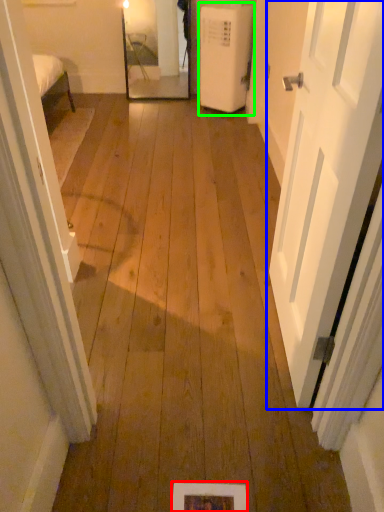
Question: Which object is positioned closest to picture frame (highlighted by a red box)? Select from door (highlighted by a blue box) and air conditioner (highlighted by a green box).

Choices:
 (A) door
 (B) air conditioner

Answer: (A)